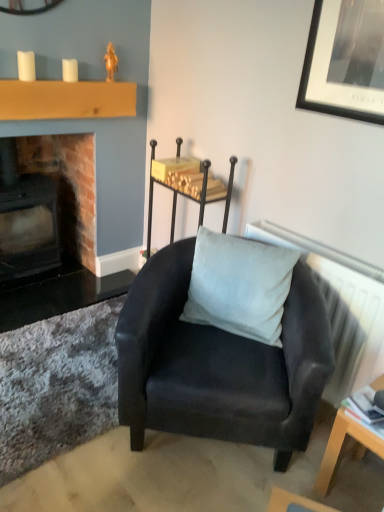
Question: Does white textured radiator at upper right come in front of brick fireplace at left?

Choices:
 (A) yes
 (B) no

Answer: (A)

Question: Is white textured radiator at upper right oriented towards brick fireplace at left?

Choices:
 (A) no
 (B) yes

Answer: (A)

Question: Can you confirm if white textured radiator at upper right is thinner than brick fireplace at left?

Choices:
 (A) yes
 (B) no

Answer: (A)

Question: Is white textured radiator at upper right located outside brick fireplace at left?

Choices:
 (A) no
 (B) yes

Answer: (B)

Question: Considering the relative sizes of white textured radiator at upper right and brick fireplace at left in the image provided, is white textured radiator at upper right taller than brick fireplace at left?

Choices:
 (A) no
 (B) yes

Answer: (A)

Question: From a real-world perspective, is matte black armchair at center physically located above or below satin black chair at center?

Choices:
 (A) below
 (B) above

Answer: (A)

Question: From the image's perspective, relative to satin black chair at center, is matte black armchair at center above or below?

Choices:
 (A) below
 (B) above

Answer: (A)

Question: From their relative heights in the image, would you say matte black armchair at center is taller or shorter than satin black chair at center?

Choices:
 (A) tall
 (B) short

Answer: (A)

Question: In terms of size, does matte black armchair at center appear bigger or smaller than satin black chair at center?

Choices:
 (A) big
 (B) small

Answer: (A)

Question: Considering their positions, is satin white pillow at center located in front of or behind brick fireplace at left?

Choices:
 (A) front
 (B) behind

Answer: (A)

Question: Considering the positions of satin white pillow at center and brick fireplace at left in the image, is satin white pillow at center wider or thinner than brick fireplace at left?

Choices:
 (A) wide
 (B) thin

Answer: (B)

Question: Is satin white pillow at center inside the boundaries of brick fireplace at left, or outside?

Choices:
 (A) inside
 (B) outside

Answer: (B)

Question: Is point (263, 272) closer or farther from the camera than point (82, 196)?

Choices:
 (A) farther
 (B) closer

Answer: (B)

Question: Based on their positions, is brick fireplace at left located to the left or right of matte black armchair at center?

Choices:
 (A) left
 (B) right

Answer: (A)

Question: Is brick fireplace at left wider or thinner than matte black armchair at center?

Choices:
 (A) thin
 (B) wide

Answer: (A)